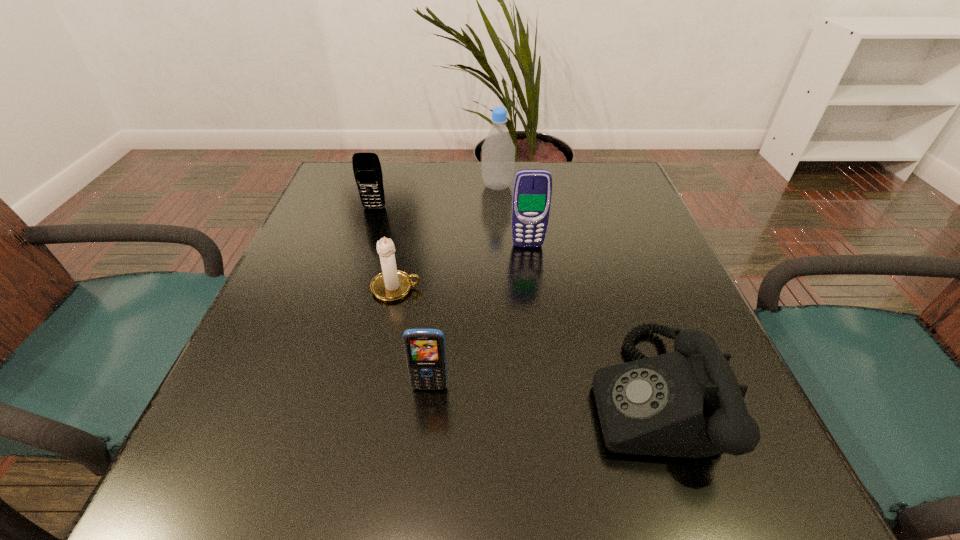
Where is `free space at the near left corner`? free space at the near left corner is located at coordinates (222, 453).

This screenshot has height=540, width=960. In order to click on free space at the far right corner in this screenshot , I will do `click(585, 198)`.

This screenshot has width=960, height=540. I want to click on vacant area that lies between the farthest object and the fourth object from right to left, so click(464, 287).

Find the location of a particular element. The height and width of the screenshot is (540, 960). free area in between the second object from left to right and the fourth nearest object is located at coordinates (462, 267).

Find the location of a particular element. Image resolution: width=960 pixels, height=540 pixels. free point between the telephone and the candle holder is located at coordinates (522, 341).

At what (x,y) coordinates should I click in order to perform the action: click on vacant point located between the farthest cellular telephone and the tallest cellular telephone. Please return your answer as a coordinate pair (x, y). Looking at the image, I should click on (451, 227).

Locate an element on the screen. This screenshot has height=540, width=960. free area in between the second cellular telephone from right to left and the second farthest cellular telephone is located at coordinates pos(479,316).

The image size is (960, 540). What are the coordinates of `blank region between the tallest cellular telephone and the candle holder` in the screenshot? It's located at (462, 267).

The width and height of the screenshot is (960, 540). I want to click on free space between the rightmost object and the candle holder, so (522, 341).

You are a GUI agent. You are given a task and a screenshot of the screen. Output one action in this format:
    pyautogui.click(x=<x>, y=<y>)
    Task: Click on the free space between the farthest object and the rightmost object
    Image resolution: width=960 pixels, height=540 pixels.
    Given the screenshot: What is the action you would take?
    pyautogui.click(x=573, y=290)